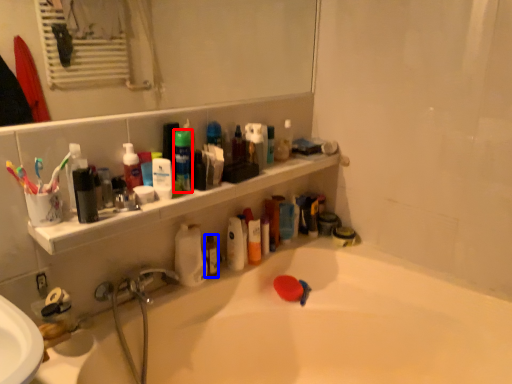
Question: Which object appears closest to the camera in this image, mouthwash (highlighted by a red box) or mouthwash (highlighted by a blue box)?

Choices:
 (A) mouthwash
 (B) mouthwash

Answer: (A)